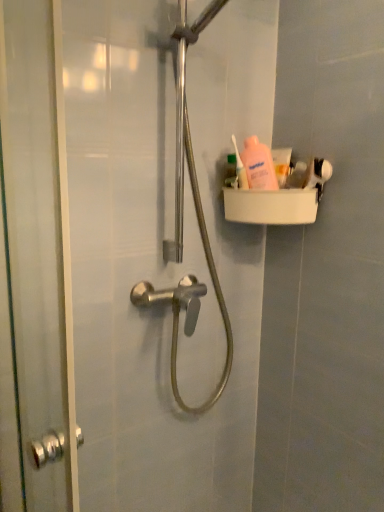
Question: Should I look upward or downward to see white matte toothpaste at upper right?

Choices:
 (A) up
 (B) down

Answer: (A)

Question: Considering the relative sizes of pink plastic bottle at upper right, which is counted as the 1th toiletry, starting from the left, and pink matte lotion at upper right, acting as the 1th toiletry starting from the right, in the image provided, is pink plastic bottle at upper right, which is counted as the 1th toiletry, starting from the left, thinner than pink matte lotion at upper right, acting as the 1th toiletry starting from the right,?

Choices:
 (A) yes
 (B) no

Answer: (A)

Question: Does pink plastic bottle at upper right, which is counted as the 1th toiletry, starting from the left, turn towards pink matte lotion at upper right, which is the 2th toiletry in left-to-right order?

Choices:
 (A) yes
 (B) no

Answer: (B)

Question: Considering the relative sizes of pink plastic bottle at upper right, the 2th toiletry from the right, and pink matte lotion at upper right, which is the 2th toiletry in left-to-right order, in the image provided, is pink plastic bottle at upper right, the 2th toiletry from the right, wider than pink matte lotion at upper right, which is the 2th toiletry in left-to-right order,?

Choices:
 (A) yes
 (B) no

Answer: (B)

Question: Is the depth of pink plastic bottle at upper right, the 2th toiletry from the right, greater than that of pink matte lotion at upper right, acting as the 1th toiletry starting from the right?

Choices:
 (A) no
 (B) yes

Answer: (A)

Question: Does pink plastic bottle at upper right, which is counted as the 1th toiletry, starting from the left, have a lesser height compared to pink matte lotion at upper right, acting as the 1th toiletry starting from the right?

Choices:
 (A) yes
 (B) no

Answer: (B)

Question: Is pink plastic bottle at upper right, the 2th toiletry from the right, beside pink matte lotion at upper right, which is the 2th toiletry in left-to-right order?

Choices:
 (A) yes
 (B) no

Answer: (B)

Question: From the image's perspective, is pink matte lotion at upper right, which is the 2th toiletry in left-to-right order, below white matte toothpaste at upper right?

Choices:
 (A) yes
 (B) no

Answer: (A)

Question: From a real-world perspective, is pink matte lotion at upper right, acting as the 1th toiletry starting from the right, positioned under white matte toothpaste at upper right based on gravity?

Choices:
 (A) no
 (B) yes

Answer: (B)

Question: Does pink matte lotion at upper right, acting as the 1th toiletry starting from the right, have a lesser width compared to white matte toothpaste at upper right?

Choices:
 (A) yes
 (B) no

Answer: (A)

Question: Does pink matte lotion at upper right, acting as the 1th toiletry starting from the right, have a smaller size compared to white matte toothpaste at upper right?

Choices:
 (A) no
 (B) yes

Answer: (B)

Question: Considering the relative positions of pink matte lotion at upper right, which is the 2th toiletry in left-to-right order, and white matte toothpaste at upper right in the image provided, is pink matte lotion at upper right, which is the 2th toiletry in left-to-right order, to the right of white matte toothpaste at upper right from the viewer's perspective?

Choices:
 (A) yes
 (B) no

Answer: (A)

Question: Is white matte toothpaste at upper right at the back of pink matte lotion at upper right, acting as the 1th toiletry starting from the right?

Choices:
 (A) yes
 (B) no

Answer: (B)

Question: Is the depth of white matte toothpaste at upper right greater than that of pink plastic bottle at upper right, the 2th toiletry from the right?

Choices:
 (A) no
 (B) yes

Answer: (B)